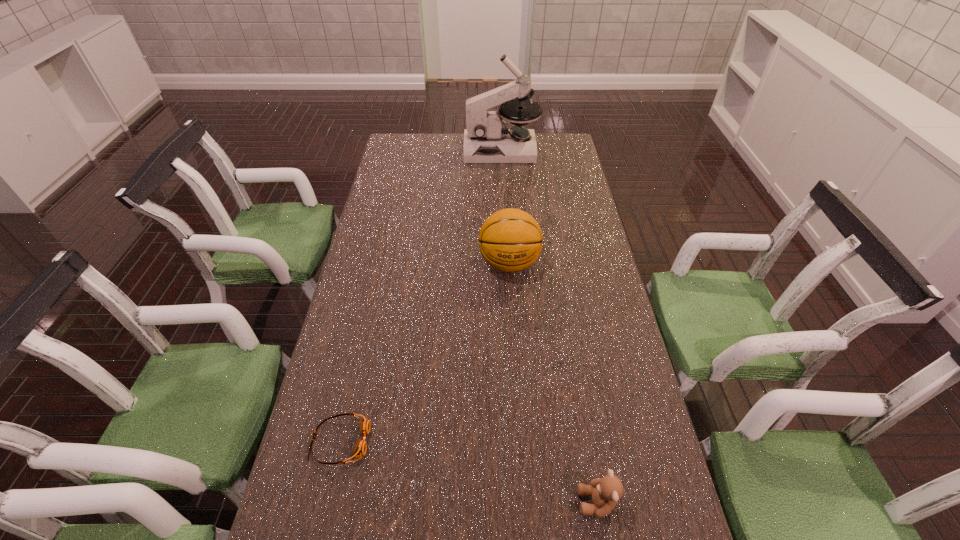
Image resolution: width=960 pixels, height=540 pixels. I want to click on vacant area situated 0.160m at the eyepiece of the microscope, so click(x=428, y=150).

Locate an element on the screen. This screenshot has width=960, height=540. free location located 0.400m on the surface of the second farthest object near the brand logo is located at coordinates (518, 404).

This screenshot has width=960, height=540. I want to click on vacant space positioned 0.400m on the face of the third tallest object, so click(x=389, y=502).

Identify the location of free space located on the face of the third tallest object. (502, 502).

Locate an element on the screen. The height and width of the screenshot is (540, 960). vacant space located on the face of the third tallest object is located at coordinates (422, 502).

You are a GUI agent. You are given a task and a screenshot of the screen. Output one action in this format:
    pyautogui.click(x=<x>, y=<y>)
    Task: Click on the free spot located with the lenses facing forward on the shortest object
    
    Given the screenshot: What is the action you would take?
    pyautogui.click(x=481, y=441)

Find the location of `object that is at the far edge`. object that is at the far edge is located at coordinates (487, 139).

The width and height of the screenshot is (960, 540). In order to click on object at the left edge in this screenshot , I will do `click(359, 451)`.

The image size is (960, 540). In order to click on microscope situated at the right edge in this screenshot , I will do click(x=487, y=139).

At what (x,y) coordinates should I click in order to perform the action: click on teddy bear at the right edge. Please return your answer as a coordinate pair (x, y). This screenshot has width=960, height=540. Looking at the image, I should click on (606, 491).